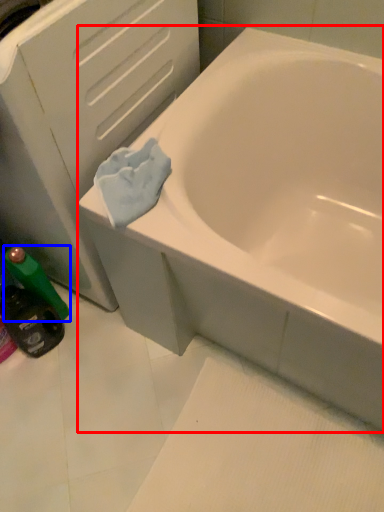
Question: Which object appears farthest to the camera in this image, bathtub (highlighted by a red box) or mouthwash (highlighted by a blue box)?

Choices:
 (A) bathtub
 (B) mouthwash

Answer: (B)